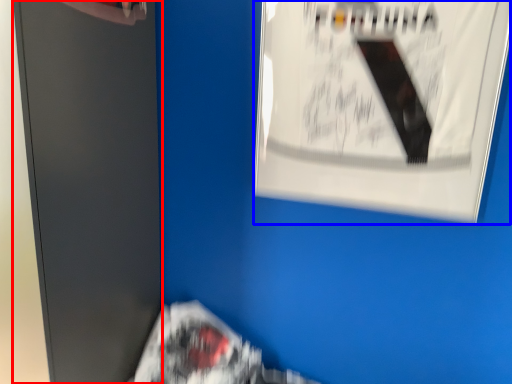
Question: Among these objects, which one is nearest to the camera, file cabinet (highlighted by a red box) or poster (highlighted by a blue box)?

Choices:
 (A) file cabinet
 (B) poster

Answer: (A)